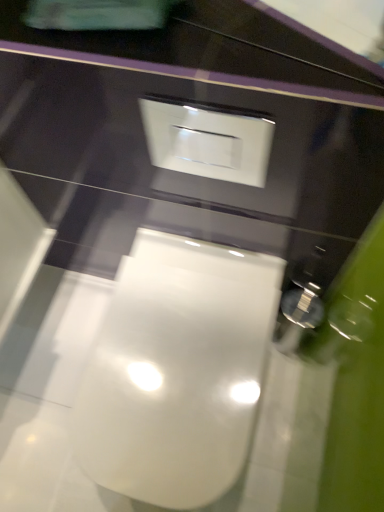
Describe the element at coordinates (208, 142) in the screenshot. The height and width of the screenshot is (512, 384). I see `white glossy switch at upper center` at that location.

You are a GUI agent. You are given a task and a screenshot of the screen. Output one action in this format:
    pyautogui.click(x=<x>, y=<y>)
    Task: Click on the white glossy switch at upper center
    This screenshot has height=512, width=384.
    Given the screenshot: What is the action you would take?
    pyautogui.click(x=208, y=142)

Where is `white glossy toilet at center`? white glossy toilet at center is located at coordinates (177, 370).

What do you see at coordinates (177, 370) in the screenshot?
I see `white glossy toilet at center` at bounding box center [177, 370].

Find the location of a particular element. Image resolution: width=384 pixels, height=512 pixels. white glossy switch at upper center is located at coordinates (208, 142).

Which object is positioned more to the right, white glossy toilet at center or white glossy switch at upper center?

white glossy switch at upper center.

Is the depth of white glossy toilet at center greater than that of white glossy switch at upper center?

Yes, the depth of white glossy toilet at center is greater than that of white glossy switch at upper center.

Which point is more distant from viewer, (174,507) or (174,148)?

The point (174,148) is farther.

From the image's perspective, is white glossy toilet at center on top of white glossy switch at upper center?

Incorrect, from the image's perspective, white glossy toilet at center is lower than white glossy switch at upper center.

In the scene shown: From a real-world perspective, does white glossy toilet at center stand above white glossy switch at upper center?

No, from a real-world perspective, white glossy toilet at center is not on top of white glossy switch at upper center.

Considering the relative sizes of white glossy toilet at center and white glossy switch at upper center in the image provided, is white glossy toilet at center wider than white glossy switch at upper center?

Indeed, white glossy toilet at center has a greater width compared to white glossy switch at upper center.

Is white glossy toilet at center taller or shorter than white glossy switch at upper center?

white glossy toilet at center is taller than white glossy switch at upper center.

Which of these two, white glossy toilet at center or white glossy switch at upper center, is smaller?

With smaller size is white glossy switch at upper center.

Looking at this image, would you say white glossy toilet at center is inside or outside white glossy switch at upper center?

The correct answer is: outside.

Is white glossy toilet at center not near white glossy switch at upper center?

No, white glossy toilet at center is not far away from white glossy switch at upper center.

Does white glossy toilet at center turn towards white glossy switch at upper center?

No.

Can you tell me how much white glossy toilet at center and white glossy switch at upper center differ in facing direction?

They differ by 0.0058 degrees in their facing directions.

Locate an element on the screen. toilet below the white glossy switch at upper center (from the image's perspective) is located at coordinates (177, 370).

Can you confirm if white glossy switch at upper center is positioned to the right of white glossy toilet at center?

Correct, you'll find white glossy switch at upper center to the right of white glossy toilet at center.

Between white glossy switch at upper center and white glossy toilet at center, which one is positioned in front?

white glossy switch at upper center is in front.

Is point (213, 125) positioned in front of point (74, 447)?

No, it is behind (74, 447).

From the image's perspective, is white glossy switch at upper center located above or below white glossy toilet at center?

white glossy switch at upper center is above white glossy toilet at center.

From a real-world perspective, does white glossy switch at upper center stand above white glossy toilet at center?

Yes, from a real-world perspective, white glossy switch at upper center is on top of white glossy toilet at center.

Does white glossy switch at upper center have a lesser width compared to white glossy toilet at center?

Yes, white glossy switch at upper center is thinner than white glossy toilet at center.

Between white glossy switch at upper center and white glossy toilet at center, which one has more height?

Standing taller between the two is white glossy toilet at center.

Which of these two, white glossy switch at upper center or white glossy toilet at center, is bigger?

With larger size is white glossy toilet at center.

Would you say white glossy switch at upper center is inside or outside white glossy toilet at center?

white glossy switch at upper center is not inside white glossy toilet at center, it's outside.

Does white glossy switch at upper center touch white glossy toilet at center?

white glossy switch at upper center is not next to white glossy toilet at center, and they're not touching.

Could you tell me if white glossy switch at upper center is facing white glossy toilet at center?

No, white glossy switch at upper center is not aimed at white glossy toilet at center.

Can you tell me how much white glossy switch at upper center and white glossy toilet at center differ in facing direction?

0.0058 degrees separate the facing orientations of white glossy switch at upper center and white glossy toilet at center.

Find the location of a particular element. toilet lying behind the white glossy switch at upper center is located at coordinates (177, 370).

Identify the location of toilet that appears below the white glossy switch at upper center (from the image's perspective). pyautogui.click(x=177, y=370).

The height and width of the screenshot is (512, 384). In order to click on toilet that appears on the left of white glossy switch at upper center in this screenshot , I will do `click(177, 370)`.